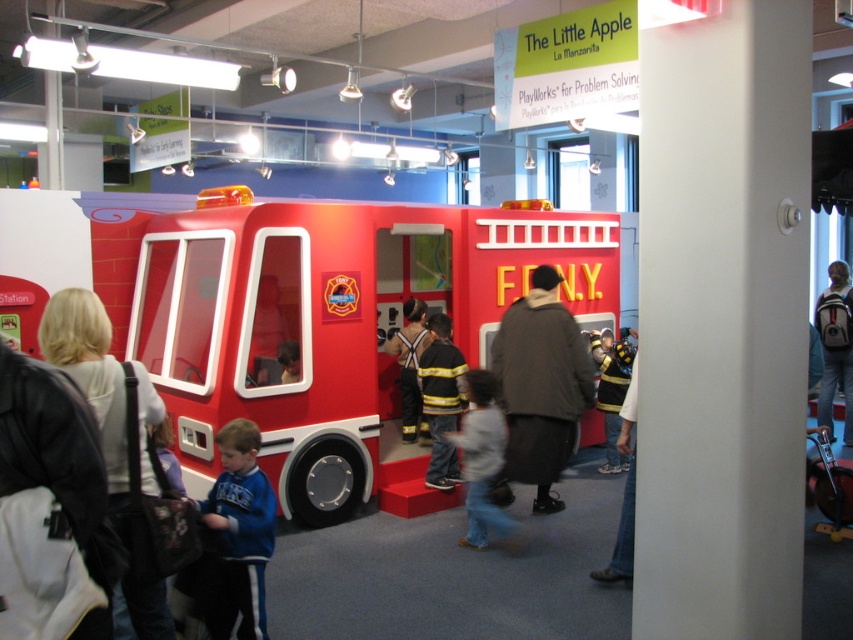
Consider the image. You are a child standing at the entrance of the play area and want to reach the point marked as point (821, 323). However, there is an obstacle at point (428, 365). Will you be able to reach your destination without moving around the obstacle?

Since point (428, 365) is in front of point (821, 323), the obstacle is blocking the path. Therefore, you will need to move around the obstacle to reach your destination.